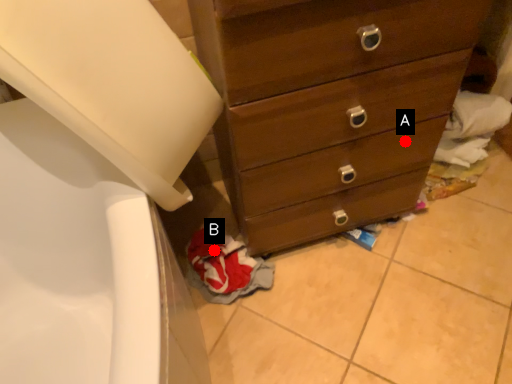
Question: Two points are circled on the image, labeled by A and B beside each circle. Which point is closer to the camera?

Choices:
 (A) A is closer
 (B) B is closer

Answer: (A)